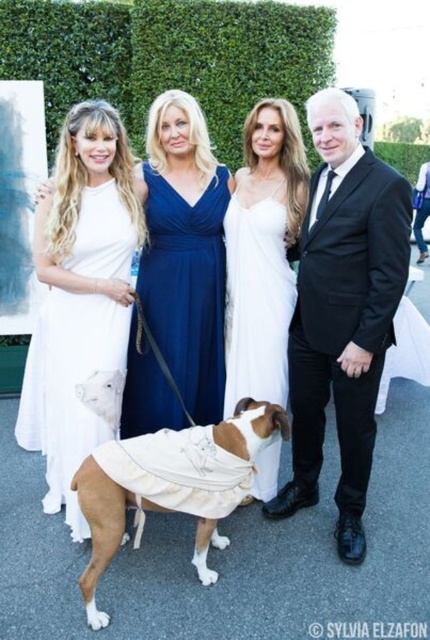
Question: Which object is positioned closest to the black satin suit at right?

Choices:
 (A) white satin dress at lower left
 (B) white textured coat at center
 (C) white satin dress at center

Answer: (C)

Question: Is blue satin dress at center bigger than white satin dress at center?

Choices:
 (A) no
 (B) yes

Answer: (B)

Question: Which point is farther to the camera?

Choices:
 (A) (263, 438)
 (B) (82, 540)

Answer: (B)

Question: Can you confirm if black satin suit at right is smaller than white satin dress at lower left?

Choices:
 (A) yes
 (B) no

Answer: (B)

Question: Estimate the real-world distances between objects in this image. Which object is closer to the black satin suit at right?

Choices:
 (A) white satin dress at lower left
 (B) white textured coat at center
 (C) white satin dress at center
 (D) blue satin dress at center

Answer: (C)

Question: Is blue satin dress at center further to the viewer compared to white satin dress at lower left?

Choices:
 (A) yes
 (B) no

Answer: (A)